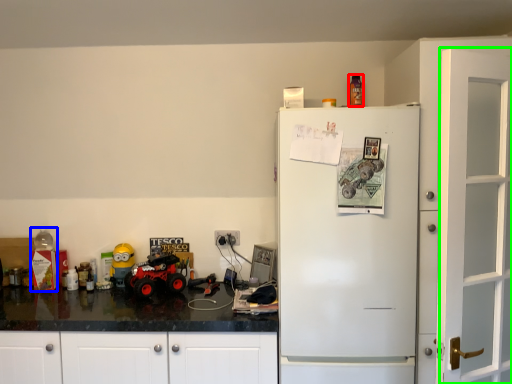
Question: Which object is the closest to the toy (highlighted by a red box)? Choose among these: toy (highlighted by a blue box) or door (highlighted by a green box).

Choices:
 (A) toy
 (B) door

Answer: (B)